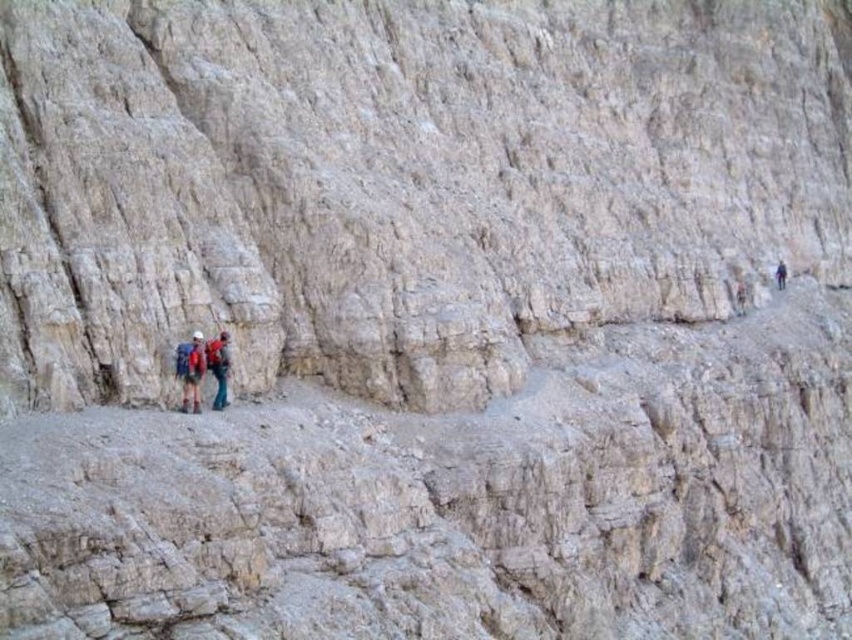
Question: Considering the relative positions of red fabric backpack at center and dark blue fabric backpack at right in the image provided, where is red fabric backpack at center located with respect to dark blue fabric backpack at right?

Choices:
 (A) right
 (B) left

Answer: (B)

Question: Considering the real-world distances, which object is closest to the matte red backpacks at center?

Choices:
 (A) red fabric backpack at center
 (B) dark blue fabric backpack at right

Answer: (A)

Question: Which of the following is the closest to the observer?

Choices:
 (A) matte red backpacks at center
 (B) red fabric backpack at center

Answer: (A)

Question: Is red fabric backpack at center to the left of dark blue fabric backpack at right from the viewer's perspective?

Choices:
 (A) yes
 (B) no

Answer: (A)

Question: Estimate the real-world distances between objects in this image. Which object is closer to the red fabric backpack at center?

Choices:
 (A) matte red backpacks at center
 (B) dark blue fabric backpack at right

Answer: (A)

Question: Does matte red backpacks at center appear on the right side of red fabric backpack at center?

Choices:
 (A) yes
 (B) no

Answer: (B)